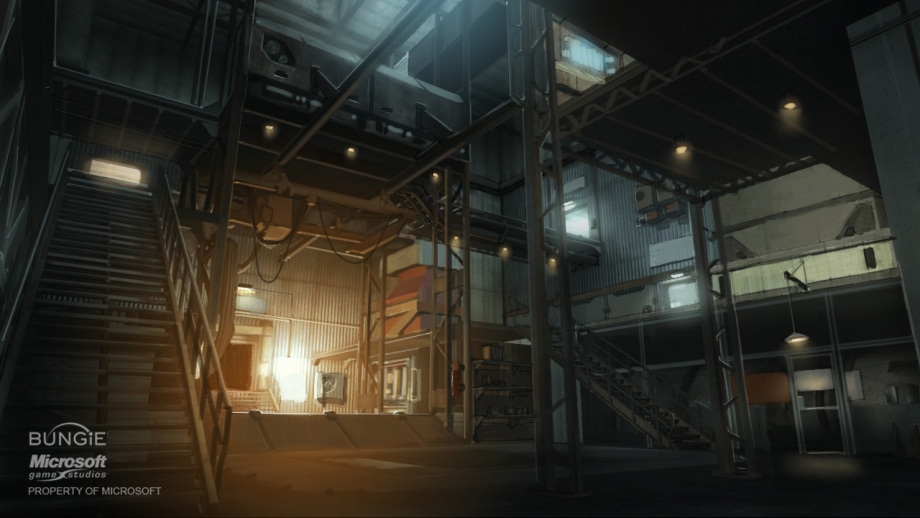
Locate an element on the screen. This screenshot has width=920, height=518. wall is located at coordinates (305, 301).